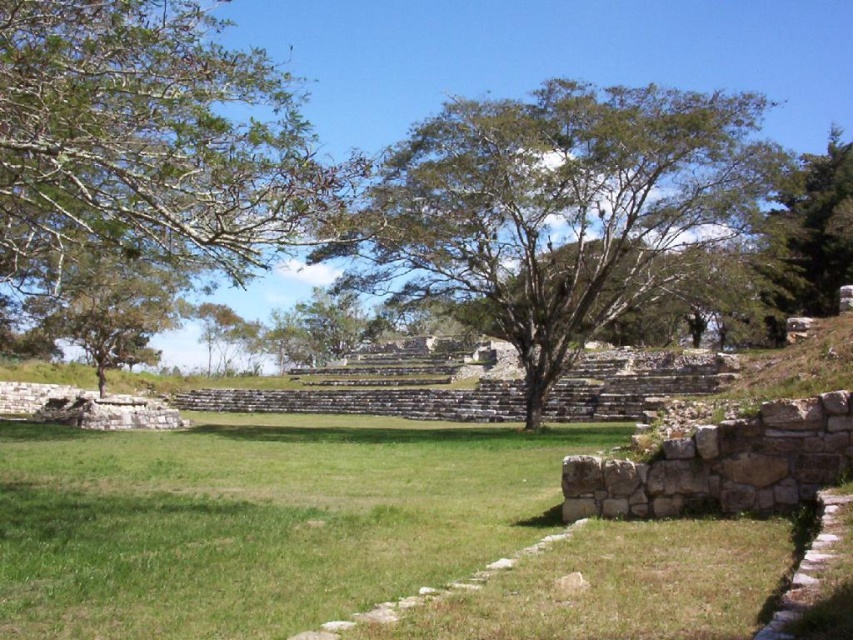
You are standing at the archaeological site and want to take a photo of the green leafy tree at upper left. If your camera has a maximum focus range of 100 feet, will you be able to capture a clear image of the tree?

The green leafy tree at upper left is 109.79 feet away from the viewer, which exceeds the camera maximum focus range of 100 feet. Therefore, you won the able to capture a clear image of the tree.